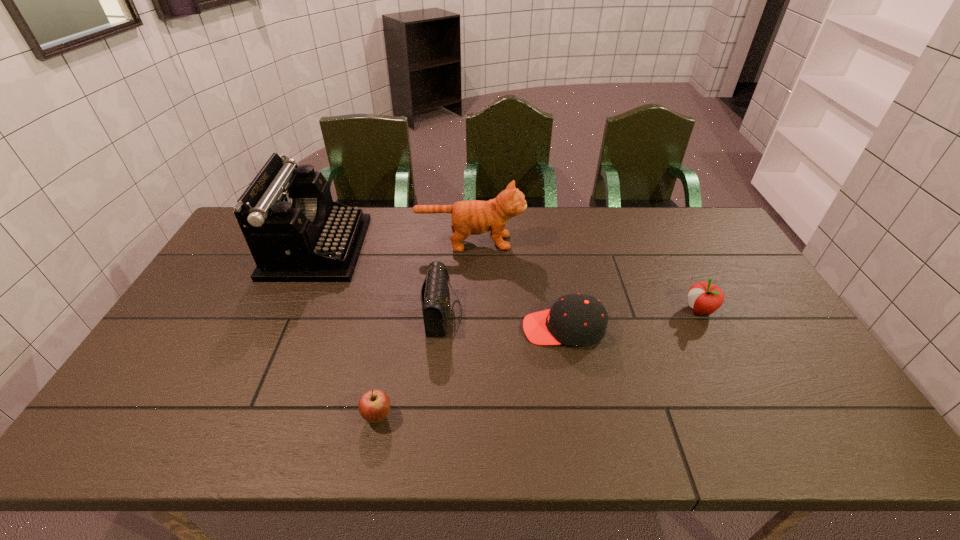
At what (x,y) coordinates should I click in order to perform the action: click on typewriter. Please return your answer as a coordinate pair (x, y). Looking at the image, I should click on (295, 232).

Find the location of a particular element. The height and width of the screenshot is (540, 960). the tallest object is located at coordinates (295, 232).

Identify the location of the second tallest object. The height and width of the screenshot is (540, 960). (473, 217).

Locate an element on the screen. clutch bag is located at coordinates (435, 291).

Where is `the right apple`? the right apple is located at coordinates (705, 298).

Where is `the rightmost object`? the rightmost object is located at coordinates (705, 298).

Where is `cap`? cap is located at coordinates tap(578, 319).

Where is `the nearer apple`? This screenshot has width=960, height=540. the nearer apple is located at coordinates (374, 405).

The width and height of the screenshot is (960, 540). Identify the location of the shorter apple. (374, 405).

The height and width of the screenshot is (540, 960). Identify the location of free point located 0.130m on the typing side of the leftmost object. (399, 248).